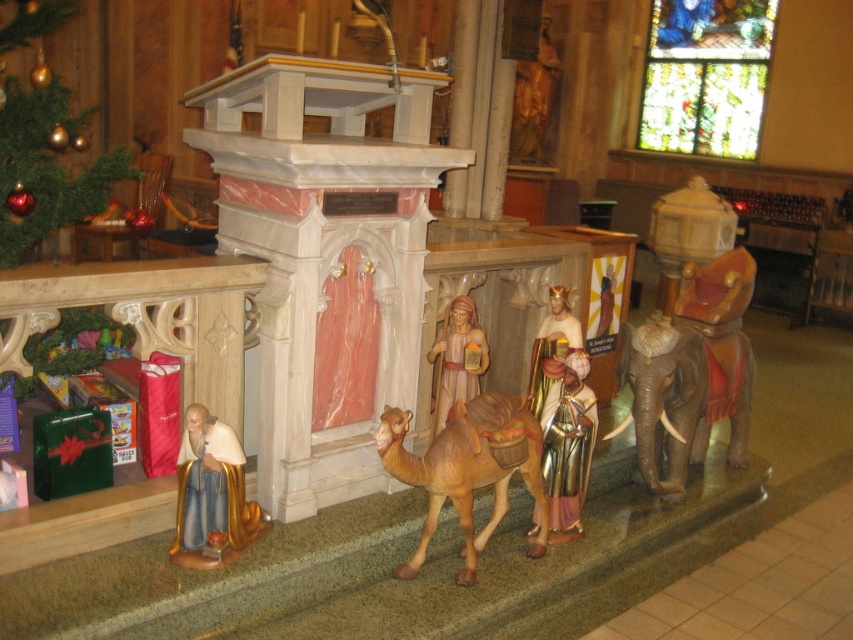
Does gold glossy statue at lower left appear under gold metallic figure at center?

Correct, gold glossy statue at lower left is located below gold metallic figure at center.

Between point (184, 538) and point (583, 358), which one is positioned behind?

Positioned behind is point (583, 358).

Locate an element on the screen. gold glossy statue at lower left is located at coordinates (212, 496).

Can you confirm if brown matte camel at center is smaller than gold glossy statue at lower left?

Actually, brown matte camel at center might be larger than gold glossy statue at lower left.

Locate an element on the screen. The width and height of the screenshot is (853, 640). brown matte camel at center is located at coordinates (467, 468).

Is gold glossy statue at lower left behind wooden figure at center?

No, gold glossy statue at lower left is closer to the viewer.

Who is positioned more to the right, gold glossy statue at lower left or wooden figure at center?

wooden figure at center is more to the right.

What do you see at coordinates (212, 496) in the screenshot? This screenshot has height=640, width=853. I see `gold glossy statue at lower left` at bounding box center [212, 496].

The image size is (853, 640). Find the location of `gold glossy statue at lower left`. gold glossy statue at lower left is located at coordinates (212, 496).